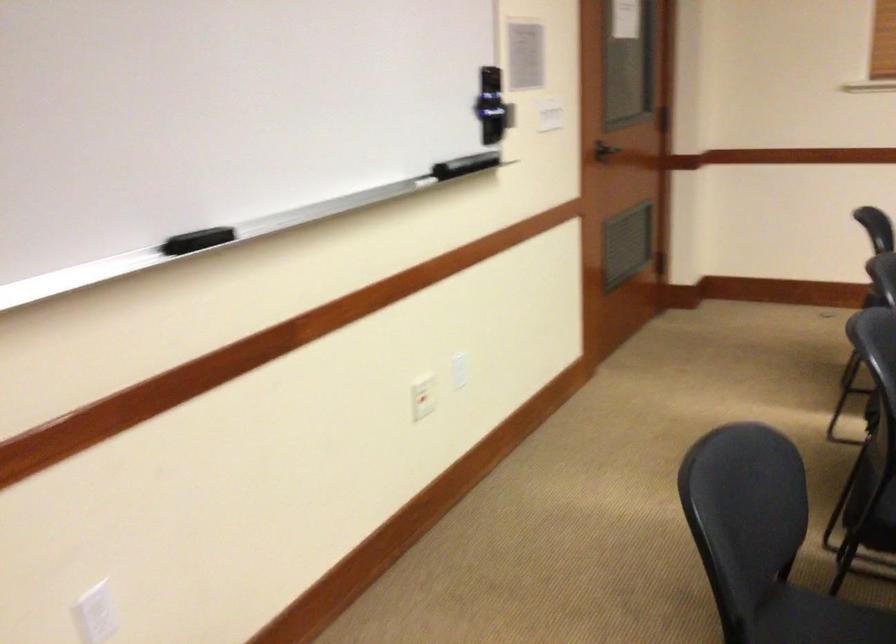
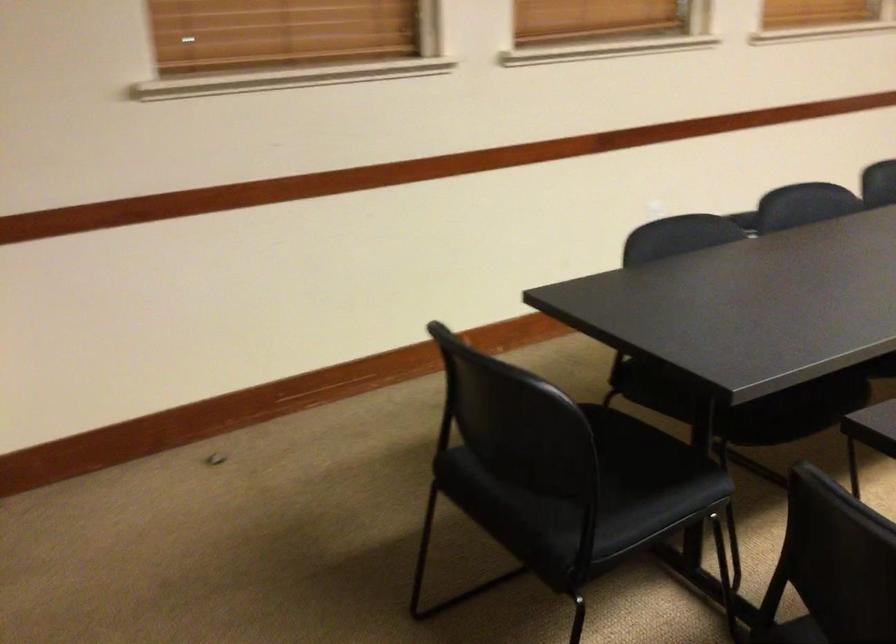
Question: What movement of the cameraman would produce the second image?

Choices:
 (A) Left
 (B) Right
 (C) Forward
 (D) Backward

Answer: (D)